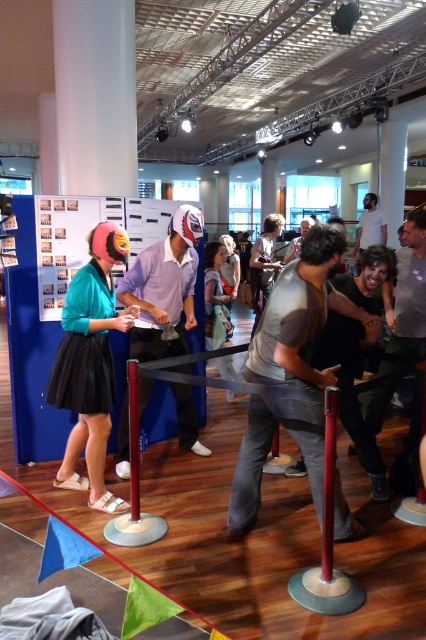
Question: Which object is farther from the camera taking this photo?

Choices:
 (A) matte gray t-shirt at center
 (B) black plastic pole at center

Answer: (A)

Question: Among these points, which one is nearest to the camera?

Choices:
 (A) (319, 576)
 (B) (402, 170)
 (C) (264, 342)
 (D) (227, 298)

Answer: (A)

Question: Is matte gray t-shirt at center bigger than white glossy pillar at upper center?

Choices:
 (A) no
 (B) yes

Answer: (A)

Question: Can you confirm if light brown fabric dress at center is positioned to the right of white matte shirt at upper center?

Choices:
 (A) yes
 (B) no

Answer: (B)

Question: Which point appears closest to the camera in this image?

Choices:
 (A) (278, 323)
 (B) (81, 54)
 (C) (373, 196)

Answer: (A)

Question: Is white matte pillar at upper left to the right of black plastic pole at center from the viewer's perspective?

Choices:
 (A) no
 (B) yes

Answer: (A)